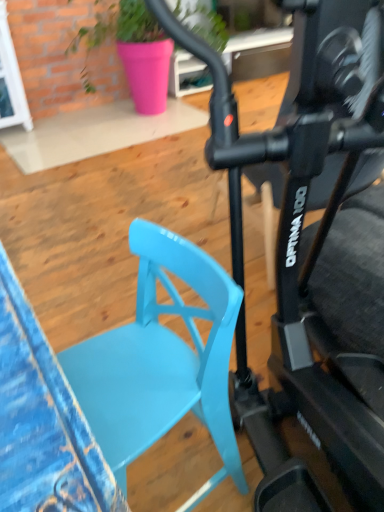
Question: Considering the relative sizes of pink ceramic pot at upper center and white glossy glass door at upper left in the image provided, is pink ceramic pot at upper center bigger than white glossy glass door at upper left?

Choices:
 (A) no
 (B) yes

Answer: (B)

Question: Can you confirm if pink ceramic pot at upper center is smaller than white glossy glass door at upper left?

Choices:
 (A) no
 (B) yes

Answer: (A)

Question: Is pink ceramic pot at upper center next to white glossy glass door at upper left and touching it?

Choices:
 (A) no
 (B) yes

Answer: (A)

Question: Can you confirm if pink ceramic pot at upper center is positioned to the left of white glossy glass door at upper left?

Choices:
 (A) no
 (B) yes

Answer: (A)

Question: Can you confirm if pink ceramic pot at upper center is thinner than white glossy glass door at upper left?

Choices:
 (A) yes
 (B) no

Answer: (B)

Question: From a real-world perspective, is matte blue chair at center-left above or below white glossy glass door at upper left?

Choices:
 (A) above
 (B) below

Answer: (B)

Question: Visually, is matte blue chair at center-left positioned to the left or to the right of white glossy glass door at upper left?

Choices:
 (A) left
 (B) right

Answer: (B)

Question: Is matte blue chair at center-left inside the boundaries of white glossy glass door at upper left, or outside?

Choices:
 (A) inside
 (B) outside

Answer: (B)

Question: From their relative heights in the image, would you say matte blue chair at center-left is taller or shorter than white glossy glass door at upper left?

Choices:
 (A) tall
 (B) short

Answer: (B)

Question: In terms of height, does white glossy glass door at upper left look taller or shorter compared to pink ceramic pot at upper center?

Choices:
 (A) short
 (B) tall

Answer: (A)

Question: Is white glossy glass door at upper left in front of or behind pink ceramic pot at upper center in the image?

Choices:
 (A) front
 (B) behind

Answer: (B)

Question: Visually, is white glossy glass door at upper left positioned to the left or to the right of pink ceramic pot at upper center?

Choices:
 (A) left
 (B) right

Answer: (A)

Question: Is point pyautogui.click(x=13, y=106) closer or farther from the camera than point pyautogui.click(x=127, y=68)?

Choices:
 (A) closer
 (B) farther

Answer: (A)

Question: Is white glossy glass door at upper left inside or outside of matte black exercise bike at center?

Choices:
 (A) outside
 (B) inside

Answer: (A)

Question: From a real-world perspective, is white glossy glass door at upper left positioned above or below matte black exercise bike at center?

Choices:
 (A) below
 (B) above

Answer: (A)